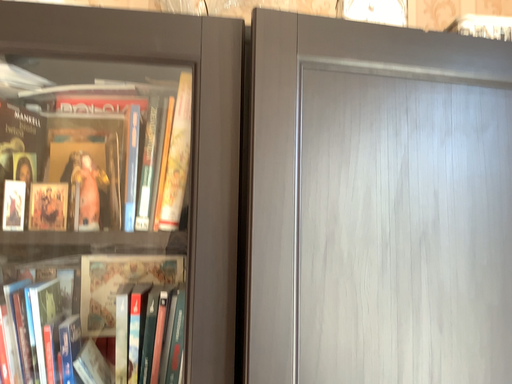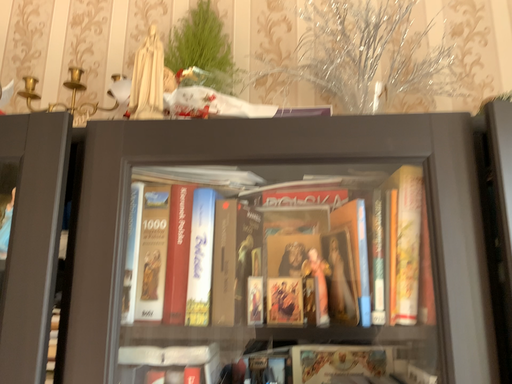
Question: How did the camera likely rotate when shooting the video?

Choices:
 (A) rotated right
 (B) rotated left

Answer: (B)